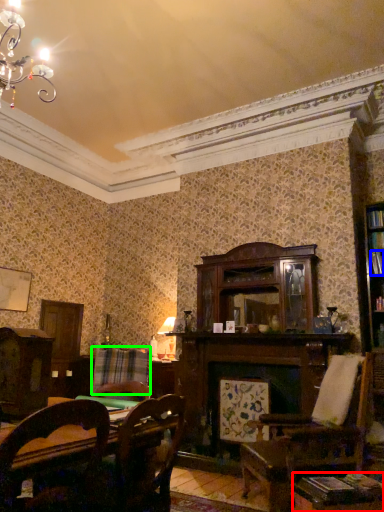
Question: Considering the real-world distances, which object is closest to table (highlighted by a red box)? book (highlighted by a blue box) or plaid (highlighted by a green box).

Choices:
 (A) book
 (B) plaid

Answer: (A)